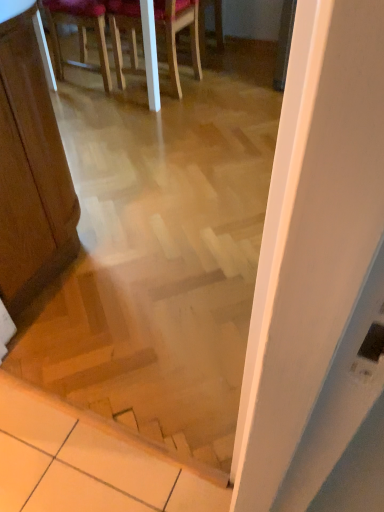
Question: Which direction should I rotate to look at wooden chair at upper center, the first chair when ordered from right to left?

Choices:
 (A) left
 (B) right

Answer: (A)

Question: From a real-world perspective, is wooden chair at upper center, which is the 1th chair in left-to-right order, physically below wooden stairs at center?

Choices:
 (A) yes
 (B) no

Answer: (A)

Question: Is wooden chair at upper center, marked as the 2th chair in a right-to-left arrangement, not close to wooden stairs at center?

Choices:
 (A) yes
 (B) no

Answer: (A)

Question: Does wooden chair at upper center, which is the 1th chair in left-to-right order, have a lesser height compared to wooden stairs at center?

Choices:
 (A) yes
 (B) no

Answer: (A)

Question: From a real-world perspective, does wooden chair at upper center, marked as the 2th chair in a right-to-left arrangement, stand above wooden stairs at center?

Choices:
 (A) no
 (B) yes

Answer: (A)

Question: Is wooden chair at upper center, marked as the 2th chair in a right-to-left arrangement, outside wooden stairs at center?

Choices:
 (A) yes
 (B) no

Answer: (A)

Question: Is wooden chair at upper center, marked as the 2th chair in a right-to-left arrangement, facing towards wooden stairs at center?

Choices:
 (A) no
 (B) yes

Answer: (A)

Question: Considering the relative sizes of wooden chair at upper center, marked as the 2th chair in a right-to-left arrangement, and wooden chair at upper center, the 2th chair from the left, in the image provided, is wooden chair at upper center, marked as the 2th chair in a right-to-left arrangement, taller than wooden chair at upper center, the 2th chair from the left,?

Choices:
 (A) no
 (B) yes

Answer: (A)

Question: Considering the relative sizes of wooden chair at upper center, which is the 1th chair in left-to-right order, and wooden chair at upper center, the first chair when ordered from right to left, in the image provided, is wooden chair at upper center, which is the 1th chair in left-to-right order, shorter than wooden chair at upper center, the first chair when ordered from right to left,?

Choices:
 (A) no
 (B) yes

Answer: (B)

Question: From the image's perspective, would you say wooden chair at upper center, which is the 1th chair in left-to-right order, is shown under wooden chair at upper center, the first chair when ordered from right to left?

Choices:
 (A) no
 (B) yes

Answer: (A)

Question: Is wooden chair at upper center, marked as the 2th chair in a right-to-left arrangement, behind wooden chair at upper center, the 2th chair from the left?

Choices:
 (A) no
 (B) yes

Answer: (B)

Question: Does wooden chair at upper center, marked as the 2th chair in a right-to-left arrangement, have a lesser width compared to wooden chair at upper center, the first chair when ordered from right to left?

Choices:
 (A) yes
 (B) no

Answer: (A)

Question: From the image's perspective, is wooden chair at upper center, which is the 1th chair in left-to-right order, on wooden chair at upper center, the first chair when ordered from right to left?

Choices:
 (A) yes
 (B) no

Answer: (A)

Question: Is wooden stairs at center turned away from wooden chair at upper center, the 2th chair from the left?

Choices:
 (A) yes
 (B) no

Answer: (B)